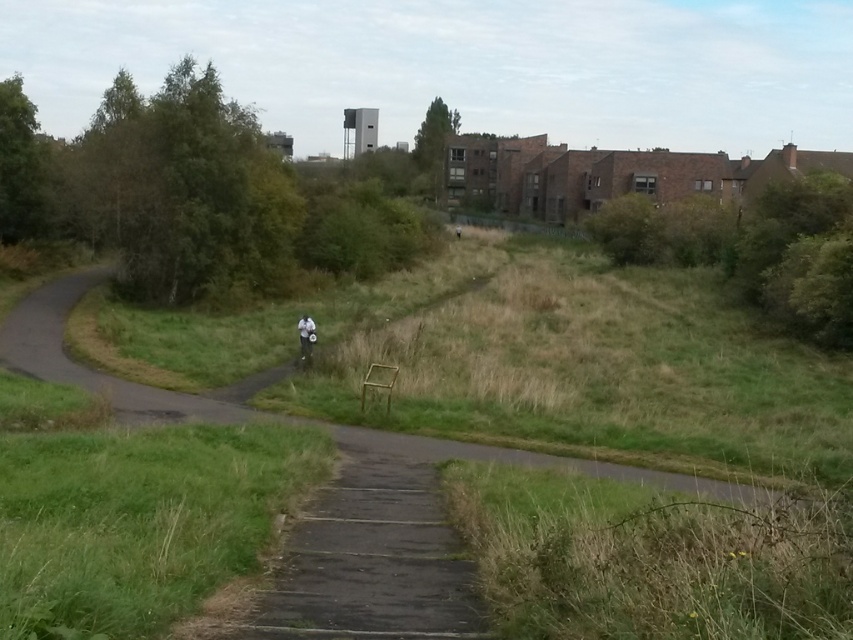
You are standing at the point labeled as point (837, 323) in this image. You want to walk straight towards the camera. How far will you have to walk to reach the camera?

The distance between point (837, 323) and the viewer is 30.60 meters, so you would need to walk 30.60 meters to reach the camera.